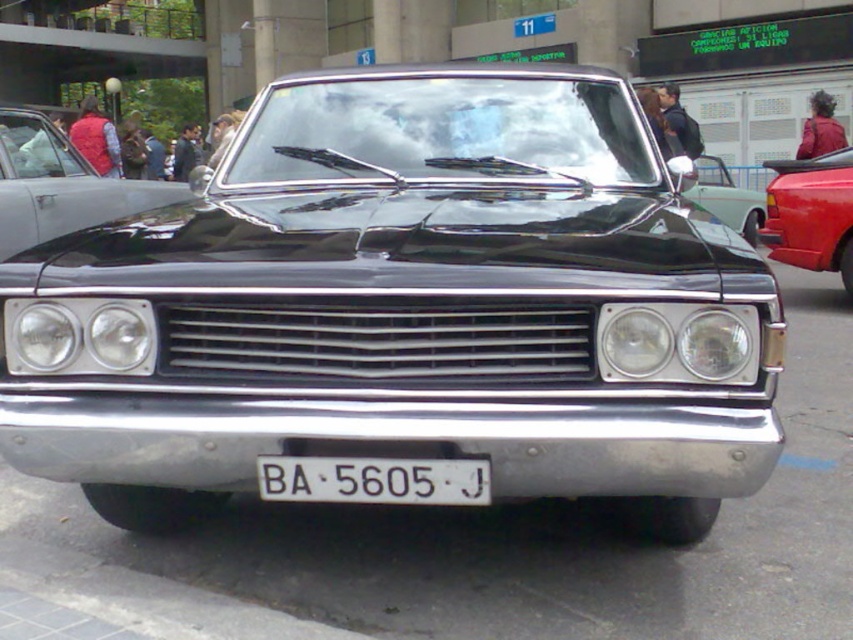
Who is taller, glossy black car at left or shiny red car at right?

glossy black car at left is taller.

Who is lower down, glossy black car at left or shiny red car at right?

shiny red car at right

Who is more distant from viewer, (38, 156) or (819, 259)?

Positioned behind is point (819, 259).

Image resolution: width=853 pixels, height=640 pixels. Find the location of `glossy black car at left`. glossy black car at left is located at coordinates (59, 184).

Can you confirm if glossy black car at left is positioned below white plastic license plate at center?

No, glossy black car at left is not below white plastic license plate at center.

Is glossy black car at left positioned before white plastic license plate at center?

No.

Does point (27, 154) come farther from viewer compared to point (480, 474)?

Yes.

Locate an element on the screen. The height and width of the screenshot is (640, 853). glossy black car at left is located at coordinates (59, 184).

Is white plastic license plate at center taller than shiny chrome mirror at center?

Incorrect, white plastic license plate at center's height is not larger of shiny chrome mirror at center's.

Between point (374, 458) and point (761, 196), which one is positioned in front?

Point (374, 458)

Is point (438, 481) positioned behind point (751, 189)?

No, (438, 481) is closer to viewer.

I want to click on white plastic license plate at center, so click(374, 481).